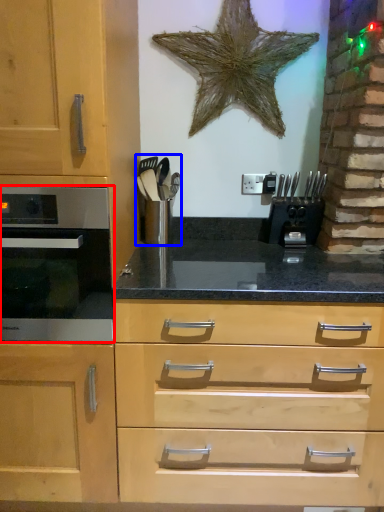
Question: Which object appears closest to the camera in this image, oven (highlighted by a red box) or appliance (highlighted by a blue box)?

Choices:
 (A) oven
 (B) appliance

Answer: (A)